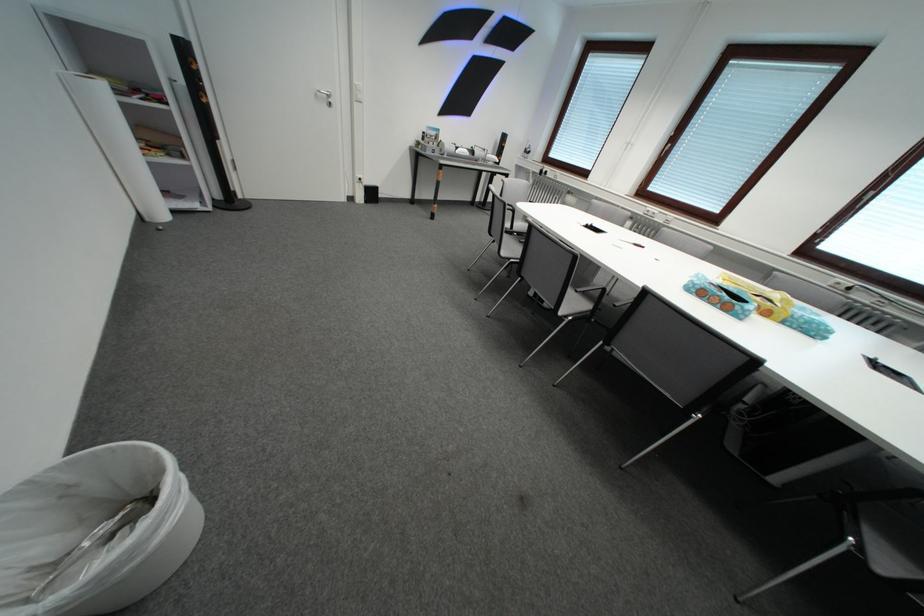
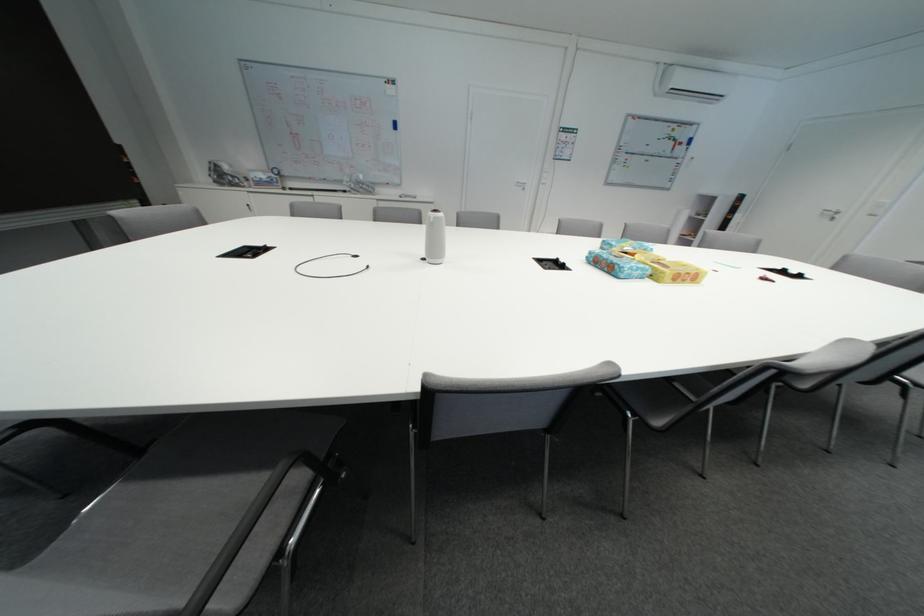
Question: I am providing you with two images of the same scene from different viewpoints. Which of the following objects are not visible in image2?

Choices:
 (A) grey chair sitting surface
 (B) black cable loop
 (C) guitar tuning key
 (D) black floor speaker

Answer: (D)